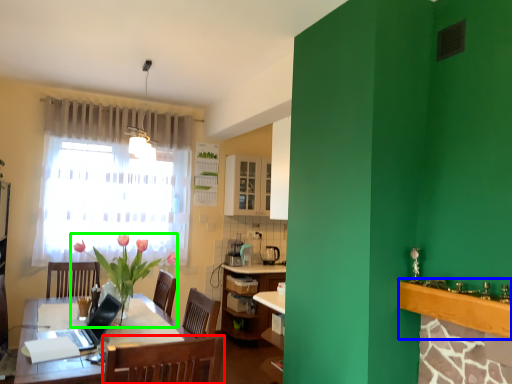
Question: Estimate the real-world distances between objects in this image. Which object is closer to chair (highlighted by a red box), counter top (highlighted by a blue box) or houseplant (highlighted by a green box)?

Choices:
 (A) counter top
 (B) houseplant

Answer: (A)